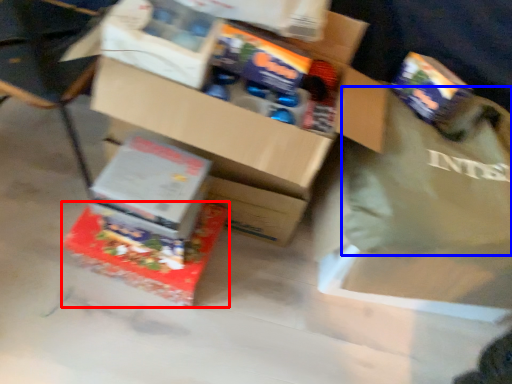
Question: Which object is further to the camera taking this photo, box (highlighted by a red box) or tote bag (highlighted by a blue box)?

Choices:
 (A) box
 (B) tote bag

Answer: (A)